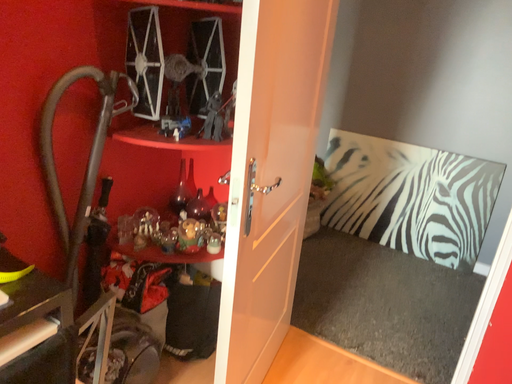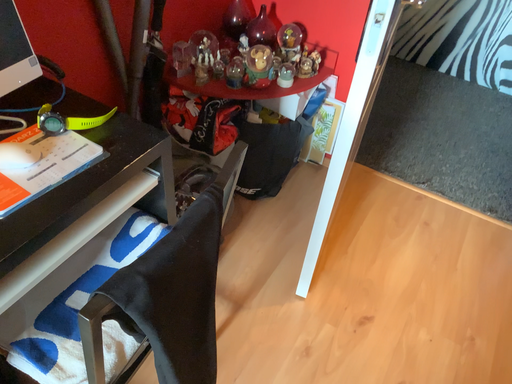
Question: Which way did the camera rotate in the video?

Choices:
 (A) rotated downward
 (B) rotated upward

Answer: (A)